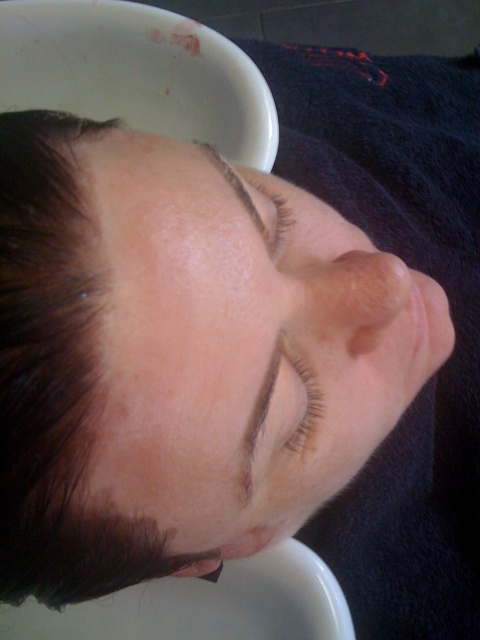
You are a photographer adjusting your camera to focus on the subject in the image. You notice two areas of smooth skin at center and smooth skin nose at center. Which area should you focus on first if you want to ensure the closest part of the face is sharp?

The smooth skin at center is closer to the viewer than the smooth skin nose at center, so you should focus on the smooth skin at center first to ensure the closest part is sharp.

You are a photographer adjusting lighting for a portrait. You need to ensure the brown matte eye at center and dark brown hair at upper center are both visible. Given their widths, which object might require more careful lighting to avoid being overwhelmed by the other?

The dark brown hair at upper center might require more careful lighting since its width is narrower than the brown matte eye at center, making it potentially less visible if not properly illuminated.

You are a photographer adjusting your camera settings. You notice two points in the image labeled as point (82, 202) and point (256, 401). Which point is nearer to you?

Point (82, 202) is closer to the viewer than point (256, 401).